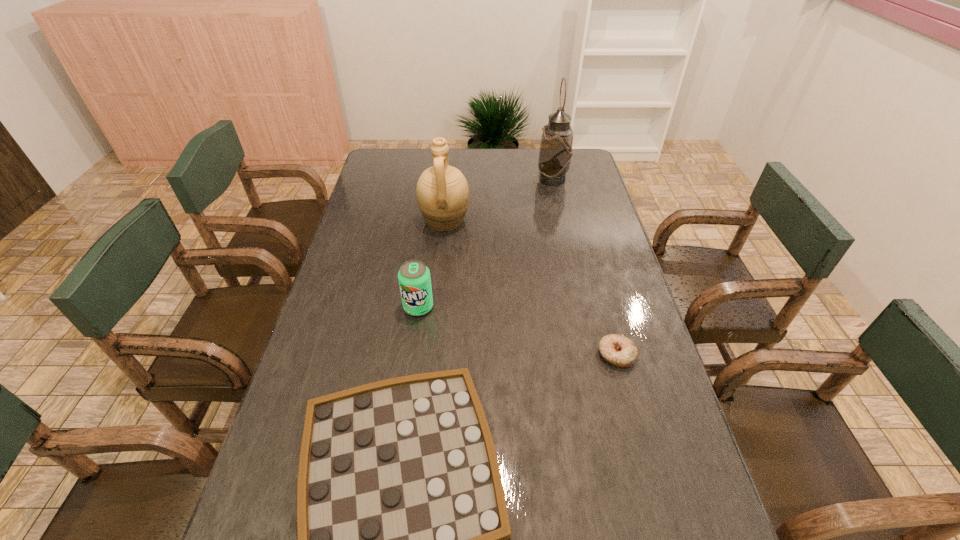
You are a GUI agent. You are given a task and a screenshot of the screen. Output one action in this format:
    pyautogui.click(x=<x>, y=<y>)
    Task: Click on the tallest object
    The width and height of the screenshot is (960, 540).
    Given the screenshot: What is the action you would take?
    pyautogui.click(x=556, y=152)

Where is `oil lamp`? Image resolution: width=960 pixels, height=540 pixels. oil lamp is located at coordinates (556, 152).

The height and width of the screenshot is (540, 960). I want to click on the second tallest object, so click(442, 191).

The height and width of the screenshot is (540, 960). In order to click on the fourth nearest object in this screenshot , I will do `click(442, 191)`.

You are a GUI agent. You are given a task and a screenshot of the screen. Output one action in this format:
    pyautogui.click(x=<x>, y=<y>)
    Task: Click on the pop soda
    The height and width of the screenshot is (540, 960).
    Given the screenshot: What is the action you would take?
    pyautogui.click(x=414, y=279)

You are a GUI agent. You are given a task and a screenshot of the screen. Output one action in this format:
    pyautogui.click(x=<x>, y=<y>)
    Task: Click on the third farthest object
    
    Given the screenshot: What is the action you would take?
    pyautogui.click(x=414, y=279)

What are the coordinates of `the fourth tallest object` in the screenshot? It's located at (618, 350).

Find the location of a particular element. doughnut is located at coordinates (618, 350).

At what (x,y) coordinates should I click in order to perform the action: click on free location located 0.100m on the front of the farthest object. Please return your answer as a coordinate pair (x, y). The height and width of the screenshot is (540, 960). Looking at the image, I should click on (558, 203).

Locate an element on the screen. Image resolution: width=960 pixels, height=540 pixels. free space located on the back of the fourth shortest object is located at coordinates (450, 165).